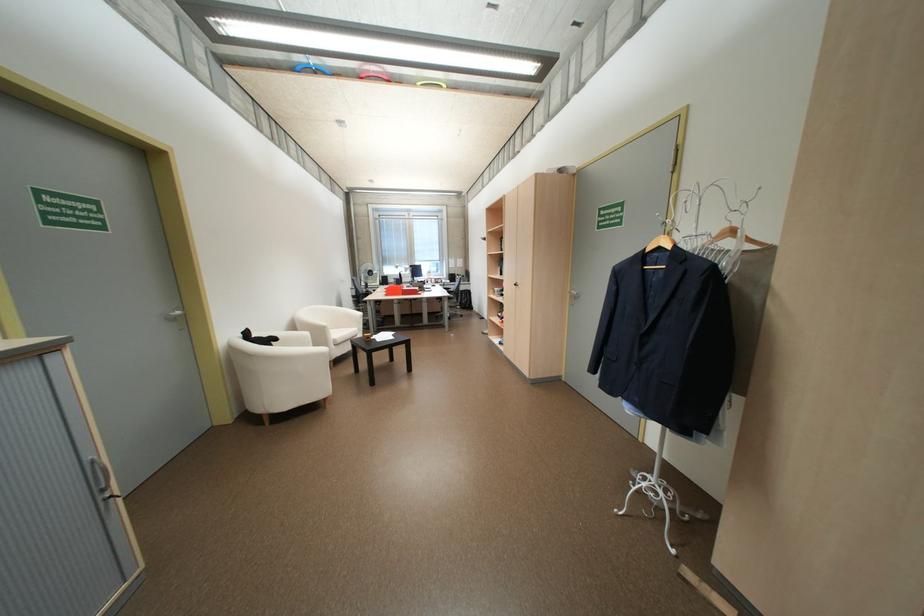
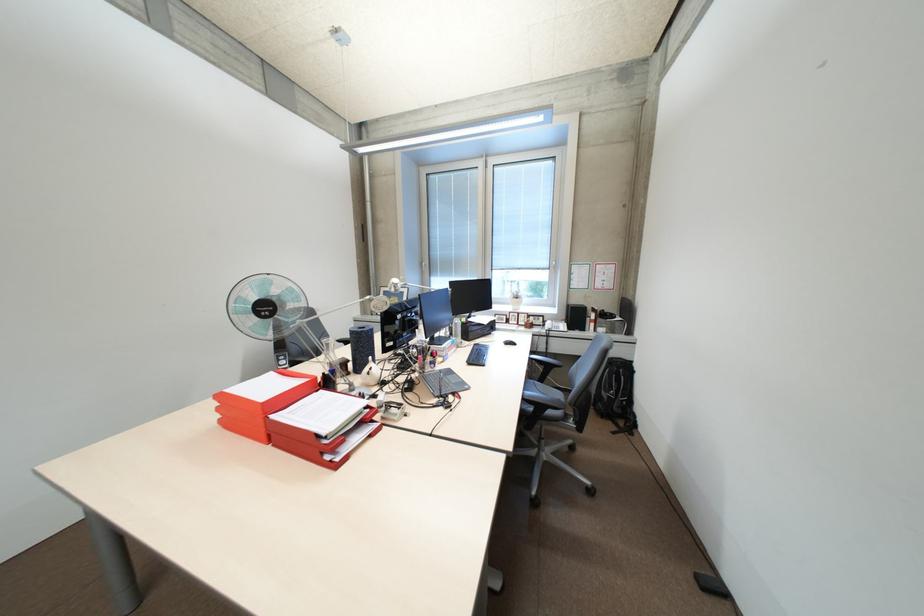
In the second image, find the point that corresponds to pixel 396 294 in the first image.

(231, 421)